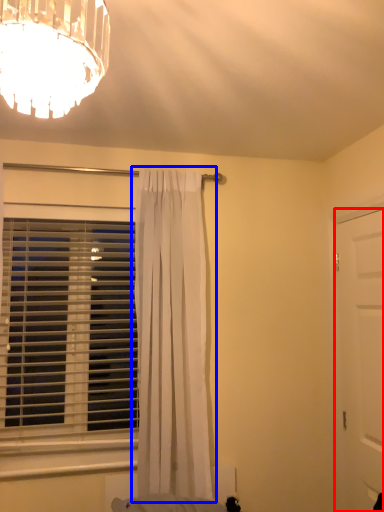
Question: Which object is further to the camera taking this photo, door (highlighted by a red box) or curtain (highlighted by a blue box)?

Choices:
 (A) door
 (B) curtain

Answer: (B)